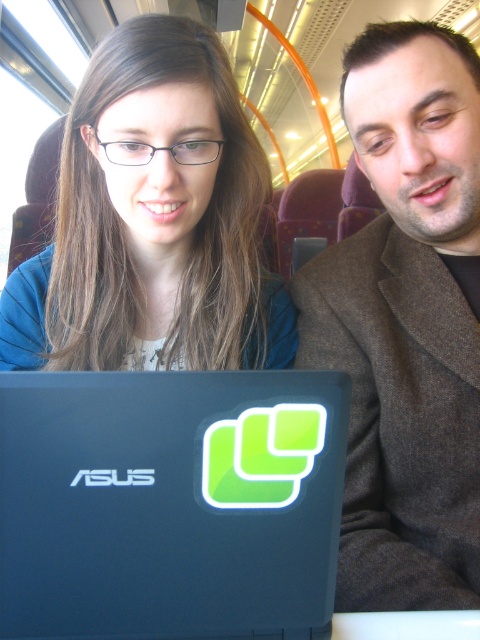
In the scene shown: You are a traveler who wants to place both the blue matte laptop at center and the brown woolen jacket at right into a rectangular storage compartment. The compartment can only fit items that are smaller than the jacket. Can you fit both items inside?

The blue matte laptop at center has a smaller size compared to brown woolen jacket at right. Since the storage compartment can only fit items smaller than the jacket, the laptop can be placed inside, but the jacket cannot. Therefore, only the blue matte laptop at center will fit.

You are a passenger on the train and want to know if the blue matte laptop at center is placed to the right of the matte blue shirt at upper left. Can you confirm this?

Yes, the blue matte laptop at center is positioned on the right side of matte blue shirt at upper left according to the description.

You are a photographer taking a portrait of the two people in the scene. The brown woolen jacket at right and the matte blue shirt at upper left are both in the frame. Which clothing item is closer to the camera?

The brown woolen jacket at right is in front of the matte blue shirt at upper left, so it is closer to the camera.